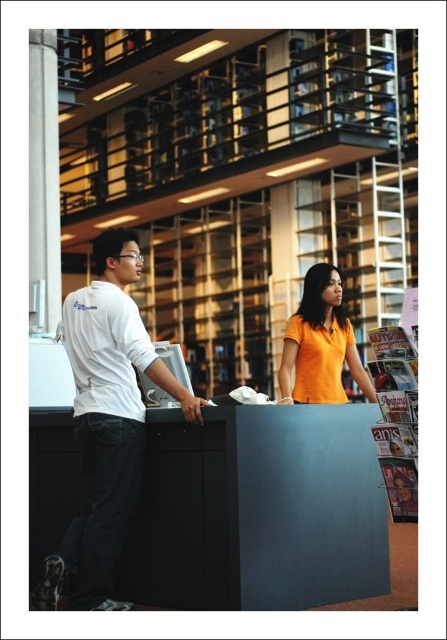
From the picture: Who is taller, matte black desk at center or orange matte shirt at center?

Standing taller between the two is matte black desk at center.

Is point (279, 572) positioned in front of point (325, 284)?

Yes, point (279, 572) is in front of point (325, 284).

The height and width of the screenshot is (640, 447). In order to click on matte black desk at center in this screenshot , I will do `click(257, 509)`.

Which is behind, point (77, 484) or point (134, 497)?

Positioned behind is point (77, 484).

Who is positioned more to the left, matte black desk at center or white matte shirt at left?

Positioned to the left is white matte shirt at left.

This screenshot has height=640, width=447. What do you see at coordinates (257, 509) in the screenshot? I see `matte black desk at center` at bounding box center [257, 509].

This screenshot has height=640, width=447. Find the location of `matte black desk at center`. matte black desk at center is located at coordinates (257, 509).

From the picture: Who is positioned more to the left, white matte shirt at left or orange matte shirt at center?

white matte shirt at left

Is white matte shirt at left positioned behind orange matte shirt at center?

No, white matte shirt at left is closer to the viewer.

Measure the distance between white matte shirt at left and camera.

white matte shirt at left is 3.68 meters away from camera.

This screenshot has width=447, height=640. In order to click on white matte shirt at left in this screenshot , I will do `click(105, 422)`.